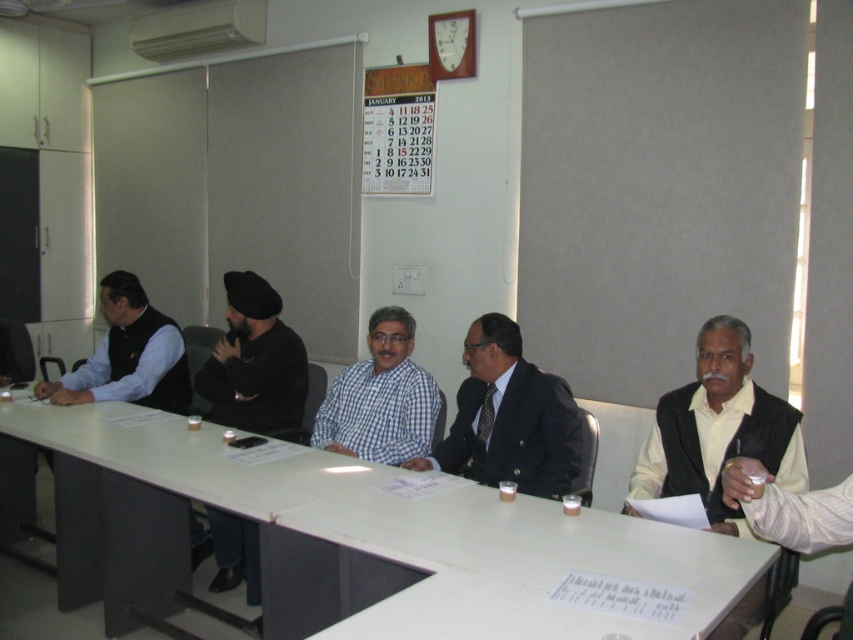
Question: Among these points, which one is farthest from the camera?

Choices:
 (A) (416, 129)
 (B) (252, 525)

Answer: (A)

Question: Can you confirm if white plastic table at center is positioned to the left of matte black vest at left?

Choices:
 (A) yes
 (B) no

Answer: (B)

Question: Which is farther from the matte black vest at right?

Choices:
 (A) black matte turban at center
 (B) blue checkered shirt at center
 (C) white plastic table at center

Answer: (A)

Question: Which point is farther from the camera taking this photo?

Choices:
 (A) [x=643, y=483]
 (B) [x=372, y=125]
 (C) [x=509, y=404]
 (D) [x=62, y=525]

Answer: (B)

Question: Is dark blue suit at center thinner than black matte turban at center?

Choices:
 (A) no
 (B) yes

Answer: (A)

Question: Can you confirm if matte black vest at right is thinner than black matte turban at center?

Choices:
 (A) no
 (B) yes

Answer: (A)